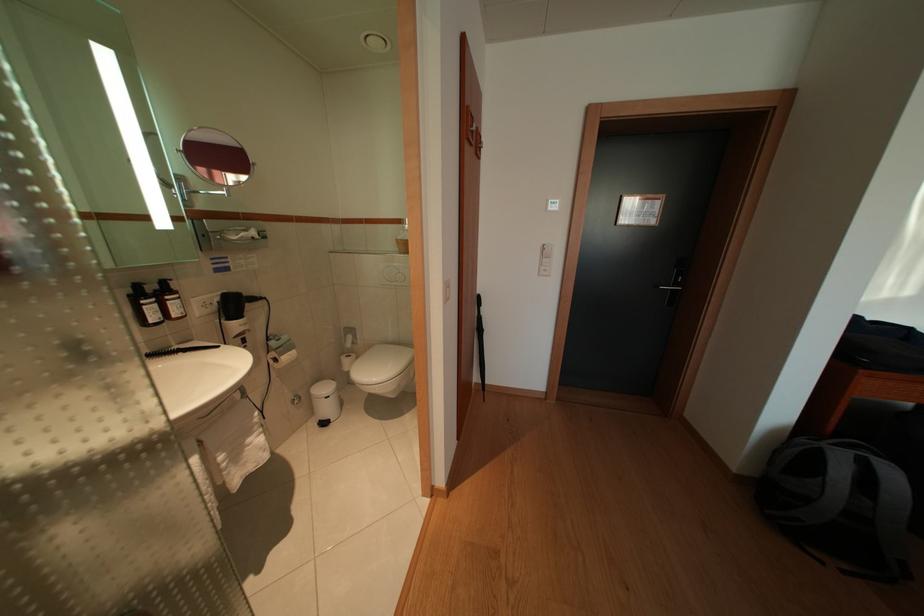
Where would you lift the black umbrella? Please return your answer as a coordinate pair (x, y).

(480, 344)